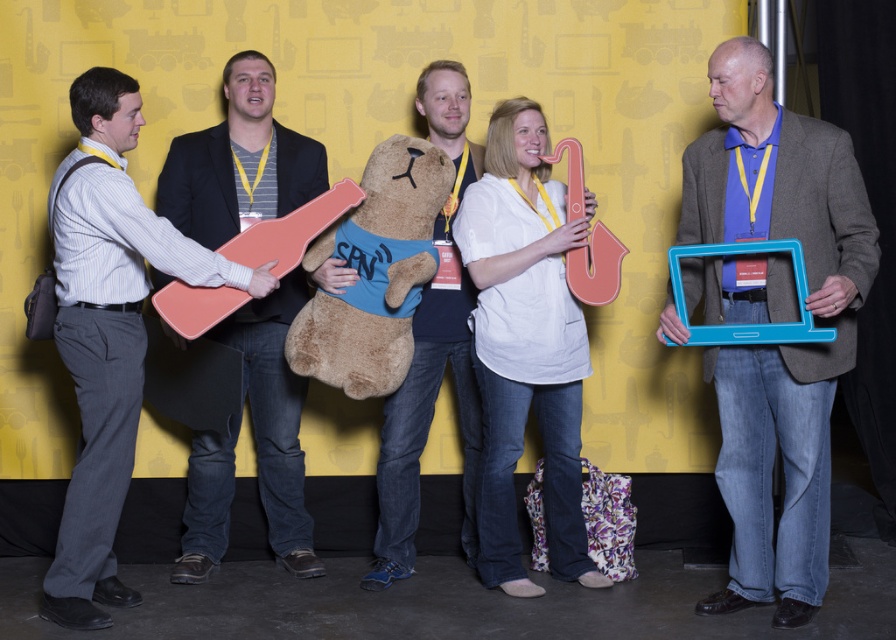
Which is behind, point (554, 573) or point (415, 413)?

The point (554, 573) is more distant.

Who is lower down, white matte saxophone at center or soft plush bear at center?

Positioned lower is white matte saxophone at center.

Is point (484, 292) positioned in front of point (381, 541)?

Yes, point (484, 292) is closer to viewer.

I want to click on white matte saxophone at center, so click(x=524, y=346).

Between blue fabric frame at right and soft plush bear at center, which one appears on the left side from the viewer's perspective?

soft plush bear at center

The width and height of the screenshot is (896, 640). What do you see at coordinates (777, 344) in the screenshot?
I see `blue fabric frame at right` at bounding box center [777, 344].

This screenshot has height=640, width=896. I want to click on blue fabric frame at right, so click(x=777, y=344).

Is blue fabric frame at right shorter than matte black guitar at left?

Yes, blue fabric frame at right is shorter than matte black guitar at left.

Is point (683, 285) more distant than point (263, 99)?

No, it is not.

Is point (790, 582) behind point (306, 154)?

No.

You are a GUI agent. You are given a task and a screenshot of the screen. Output one action in this format:
    pyautogui.click(x=<x>, y=<y>)
    Task: Click on the blue fabric frame at right
    The height and width of the screenshot is (640, 896).
    Given the screenshot: What is the action you would take?
    pyautogui.click(x=777, y=344)